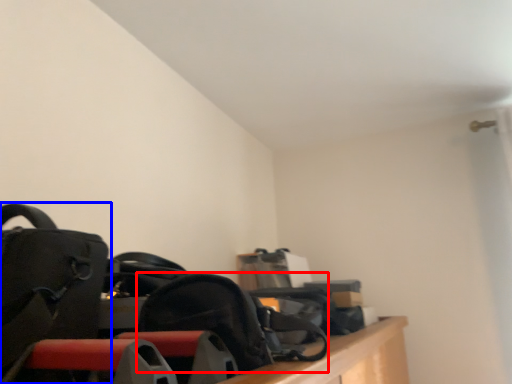
Question: Which point is closer to the camera, shoulder bag (highlighted by a red box) or luggage and bags (highlighted by a blue box)?

Choices:
 (A) shoulder bag
 (B) luggage and bags

Answer: (B)